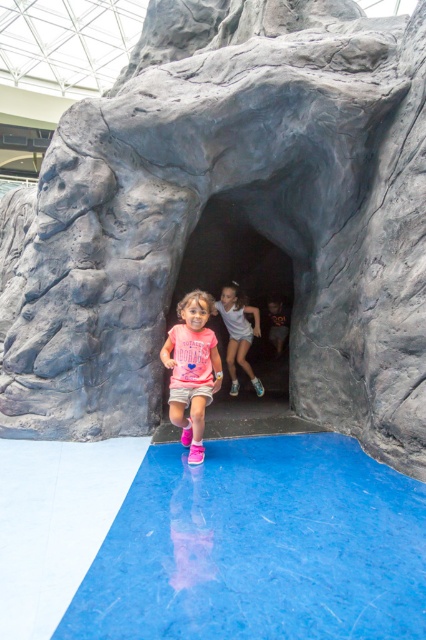
Question: Which point appears farthest from the camera in this image?

Choices:
 (A) tap(187, 438)
 (B) tap(235, 323)

Answer: (B)

Question: Can you confirm if pink matte shorts at center is bigger than white cotton dress at center?

Choices:
 (A) no
 (B) yes

Answer: (A)

Question: Does pink matte shorts at center appear over white cotton dress at center?

Choices:
 (A) no
 (B) yes

Answer: (A)

Question: Which object appears closest to the camera in this image?

Choices:
 (A) pink matte shorts at center
 (B) white cotton dress at center

Answer: (A)

Question: Can you confirm if pink matte shorts at center is thinner than white cotton dress at center?

Choices:
 (A) no
 (B) yes

Answer: (B)

Question: Which point is closer to the camera?

Choices:
 (A) (210, 308)
 (B) (247, 364)

Answer: (A)